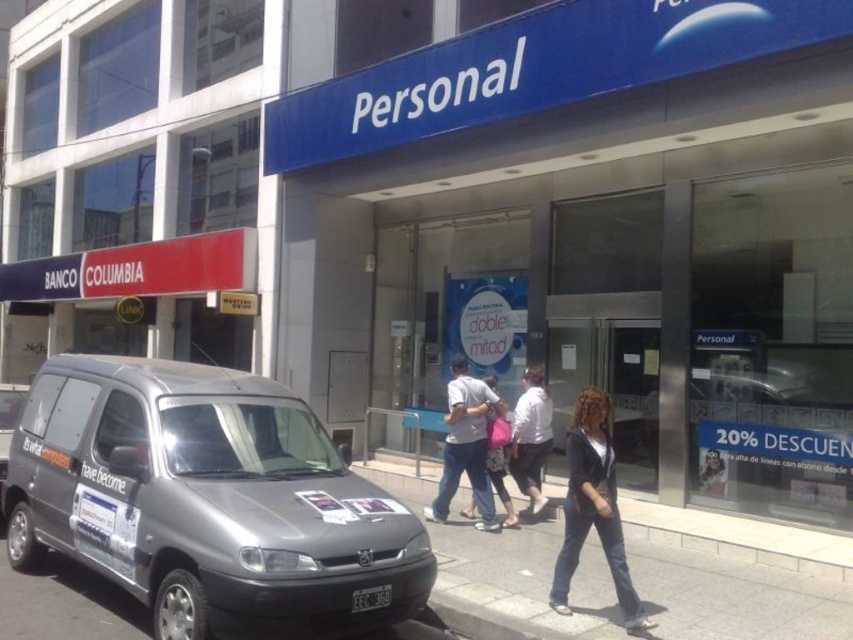
You are a delivery person trying to deliver a package to the store with the blue signboard. You see the blue plastic sign at upper center and the light gray concrete sidewalk at center. Which object is bigger in size?

The blue plastic sign at upper center is larger in size than the light gray concrete sidewalk at center.

You are a delivery person standing in front of the storefront. You need to place a package between the denim pants at center and the white cotton shirt at center. The package measures 18 inches in length. Is there enough space between them to fit the package?

The denim pants at center is 21.48 inches from the white cotton shirt at center. Since the package is 18 inches long, there is sufficient space to fit it between them.